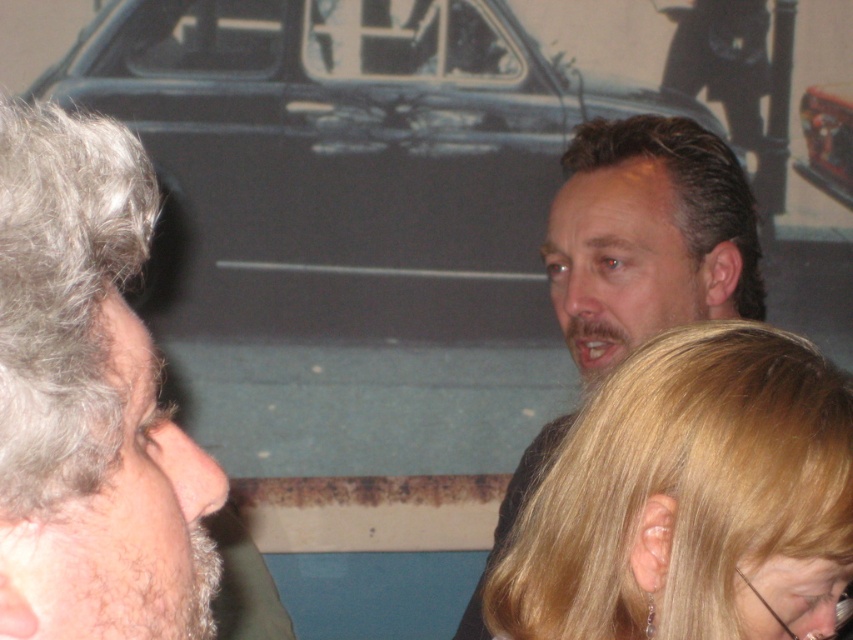
Is matte black car at center wider than shiny metallic car at upper center?

Indeed, matte black car at center has a greater width compared to shiny metallic car at upper center.

Can you confirm if matte black car at center is positioned above shiny metallic car at upper center?

Incorrect, matte black car at center is not positioned above shiny metallic car at upper center.

Image resolution: width=853 pixels, height=640 pixels. I want to click on matte black car at center, so click(341, 161).

This screenshot has width=853, height=640. Describe the element at coordinates (647, 236) in the screenshot. I see `dark brown hair at center` at that location.

Can you confirm if dark brown hair at center is positioned below shiny metallic car at upper center?

Yes.

Who is more distant from viewer, (672, 132) or (831, 172)?

Point (831, 172)

The image size is (853, 640). Identify the location of dark brown hair at center. (647, 236).

Image resolution: width=853 pixels, height=640 pixels. What do you see at coordinates (691, 499) in the screenshot?
I see `blonde hair at center` at bounding box center [691, 499].

Does point (601, 588) come behind point (817, 164)?

No.

Is point (688, 561) positioned behind point (831, 125)?

That is False.

Where is `blonde hair at center`? The height and width of the screenshot is (640, 853). blonde hair at center is located at coordinates (691, 499).